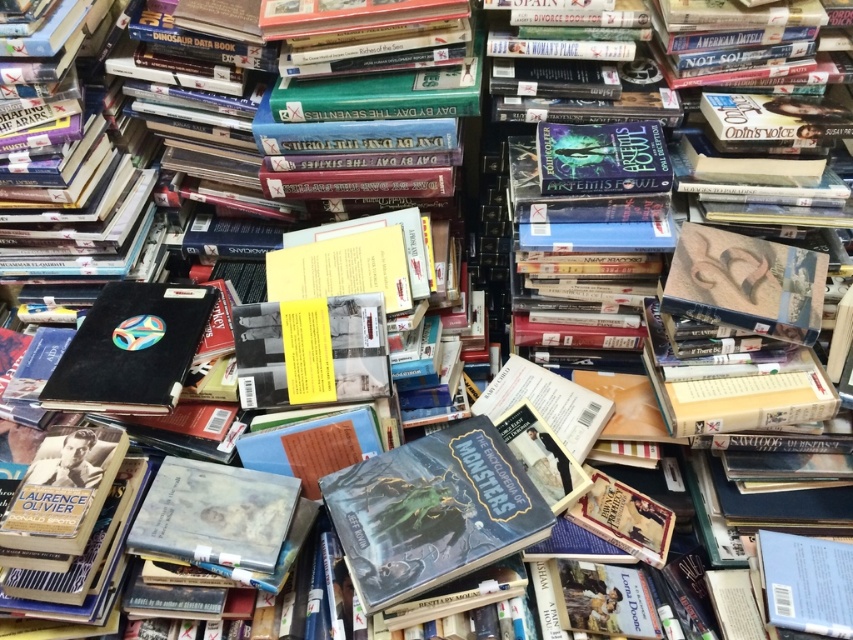
Question: Which point is farther to the camera?

Choices:
 (A) hardcover book at center
 (B) black matte book at center

Answer: (B)

Question: Which point is farther to the camera?

Choices:
 (A) hardcover book at center
 (B) black matte book at center

Answer: (B)

Question: Where is hardcover book at center located in relation to black matte book at center in the image?

Choices:
 (A) above
 (B) below

Answer: (B)

Question: Which of the following is the farthest from the observer?

Choices:
 (A) hardcover book at center
 (B) black matte book at center

Answer: (B)

Question: Is hardcover book at center below black matte book at center?

Choices:
 (A) no
 (B) yes

Answer: (B)

Question: Is hardcover book at center positioned in front of black matte book at center?

Choices:
 (A) yes
 (B) no

Answer: (A)